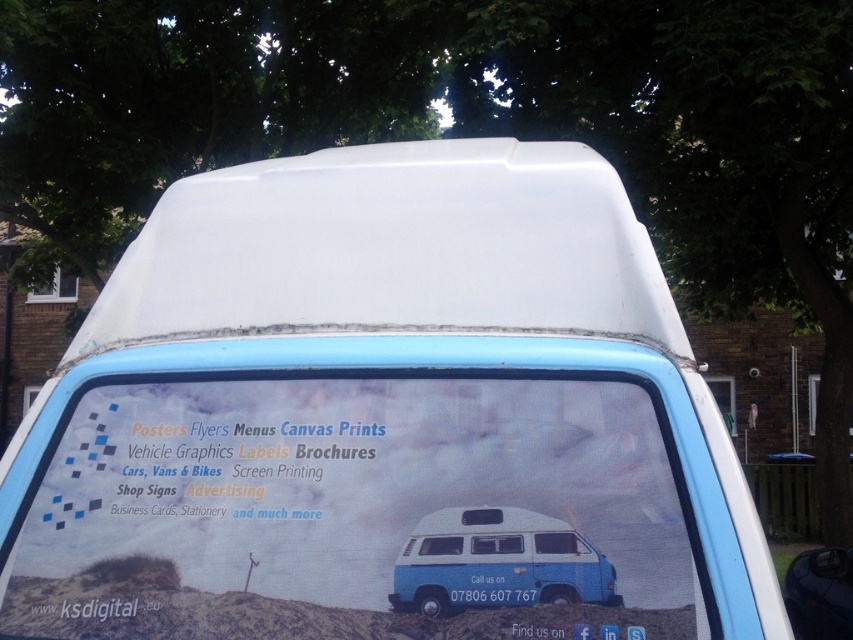
Does point (532, 148) come farther from viewer compared to point (514, 564)?

That is True.

Can you confirm if white matte van at center is shorter than blue matte van at center?

Incorrect, white matte van at center's height does not fall short of blue matte van at center's.

I want to click on white matte van at center, so click(x=383, y=419).

Find the location of `white matte van at center`. white matte van at center is located at coordinates (383, 419).

Who is positioned more to the right, white matte van at center or white plastic license plate at center?

Positioned to the right is white plastic license plate at center.

Does white matte van at center have a smaller size compared to white plastic license plate at center?

A: Actually, white matte van at center might be larger than white plastic license plate at center.

Is point (55, 470) positioned before point (457, 602)?

No, (55, 470) is further to viewer.

Where is `white matte van at center`? white matte van at center is located at coordinates (383, 419).

Measure the distance between point (408, 548) and camera.

They are 4.76 feet apart.

Can you confirm if blue matte van at center is thinner than white plastic license plate at center?

No, blue matte van at center is not thinner than white plastic license plate at center.

Does point (521, 524) come in front of point (473, 602)?

No, (521, 524) is behind (473, 602).

Where is `blue matte van at center`? The image size is (853, 640). blue matte van at center is located at coordinates (497, 563).